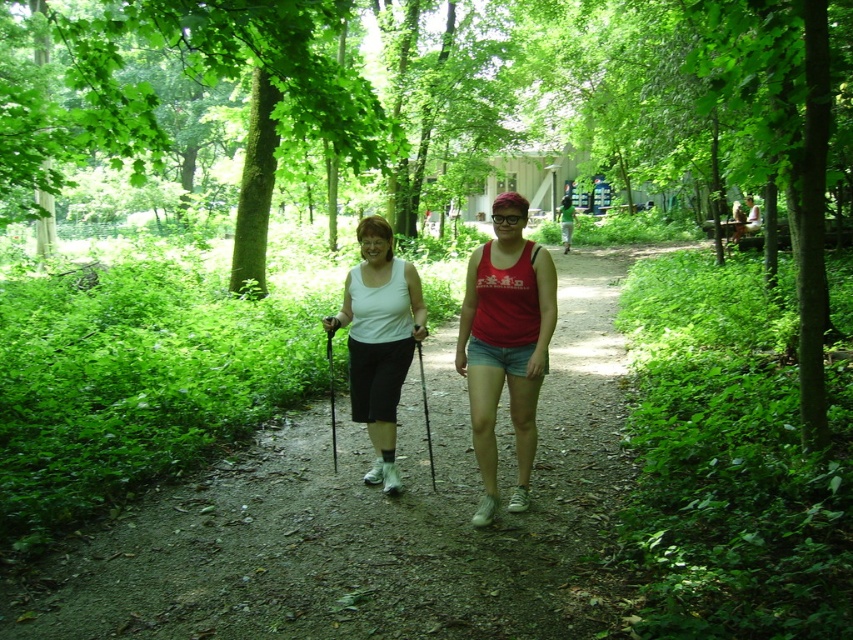
You are a photographer trying to capture the two hikers in the forest. You want to focus on the red cotton tank top at center. Where is the point at coordinates (505, 342) located?

The point at coordinates (505, 342) is located on the red cotton tank top at center.